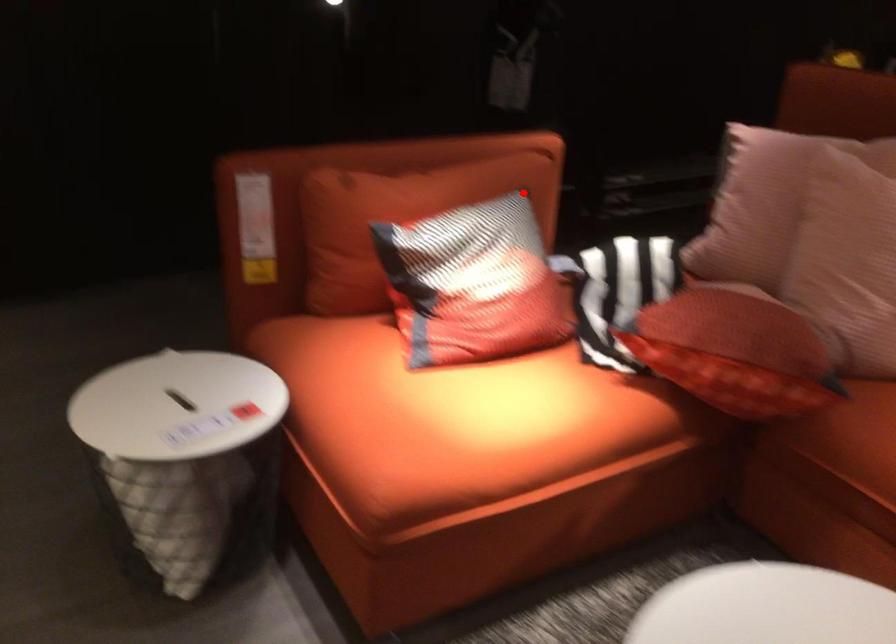
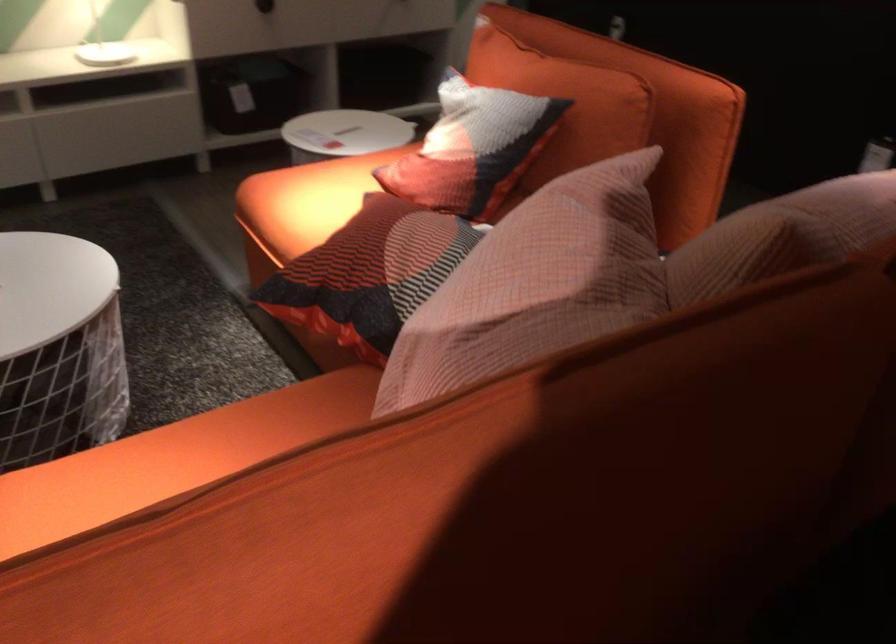
Question: I am providing you with two images of the same scene from different viewpoints. A red point is marked on the first image. Can you still see the location of the red point in image 2?

Choices:
 (A) Yes
 (B) No

Answer: (A)